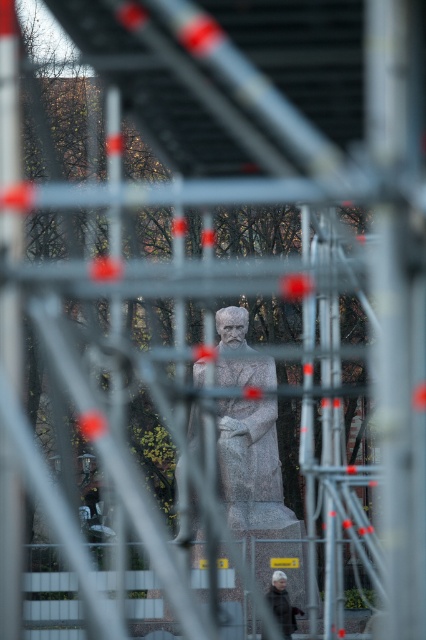
Question: From the image, what is the correct spatial relationship of granite statue at center in relation to gray woolen coat at lower center?

Choices:
 (A) below
 (B) above

Answer: (B)

Question: Is granite statue at center in front of gray woolen coat at lower center?

Choices:
 (A) no
 (B) yes

Answer: (A)

Question: From the image, what is the correct spatial relationship of granite statue at center in relation to gray woolen coat at lower center?

Choices:
 (A) right
 (B) left

Answer: (B)

Question: Which point is closer to the camera?

Choices:
 (A) gray woolen coat at lower center
 (B) granite statue at center

Answer: (A)

Question: Which point is closer to the camera?

Choices:
 (A) gray woolen coat at lower center
 (B) granite statue at center

Answer: (A)